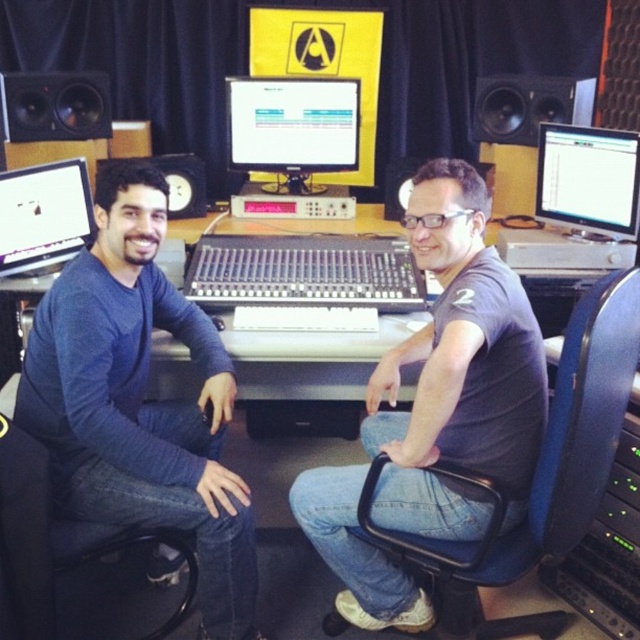
Based on the photo, does black fabric swivel chair at left have a smaller size compared to black matte speaker at upper left?

Actually, black fabric swivel chair at left might be larger than black matte speaker at upper left.

Between point (54, 550) and point (108, 84), which one is positioned behind?

Positioned behind is point (108, 84).

Locate an element on the screen. The height and width of the screenshot is (640, 640). black fabric swivel chair at left is located at coordinates (61, 538).

Who is higher up, blue cotton shirt at center or matte black monitor at left?

Positioned higher is matte black monitor at left.

Measure the distance between blue cotton shirt at center and camera.

blue cotton shirt at center and camera are 1.54 meters apart from each other.

Is point (92, 292) positioned behind point (38, 228)?

That is False.

Locate an element on the screen. The width and height of the screenshot is (640, 640). blue cotton shirt at center is located at coordinates (138, 400).

Between matte black monitor at center and black fabric swivel chair at left, which one is positioned higher?

Positioned higher is matte black monitor at center.

Does matte black monitor at center appear over black fabric swivel chair at left?

Indeed, matte black monitor at center is positioned over black fabric swivel chair at left.

Image resolution: width=640 pixels, height=640 pixels. What do you see at coordinates (292, 125) in the screenshot? I see `matte black monitor at center` at bounding box center [292, 125].

The height and width of the screenshot is (640, 640). Find the location of `matte black monitor at center`. matte black monitor at center is located at coordinates pyautogui.click(x=292, y=125).